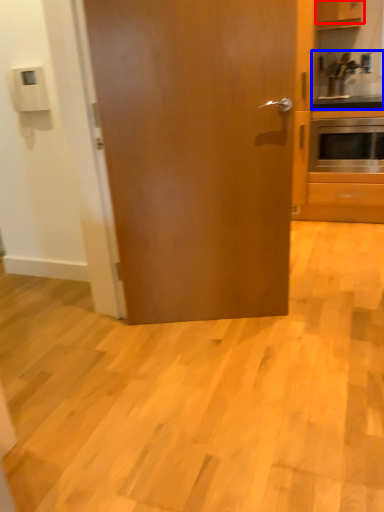
Question: Which of the following is the closest to the observer, cabinetry (highlighted by a red box) or sink (highlighted by a blue box)?

Choices:
 (A) cabinetry
 (B) sink

Answer: (A)